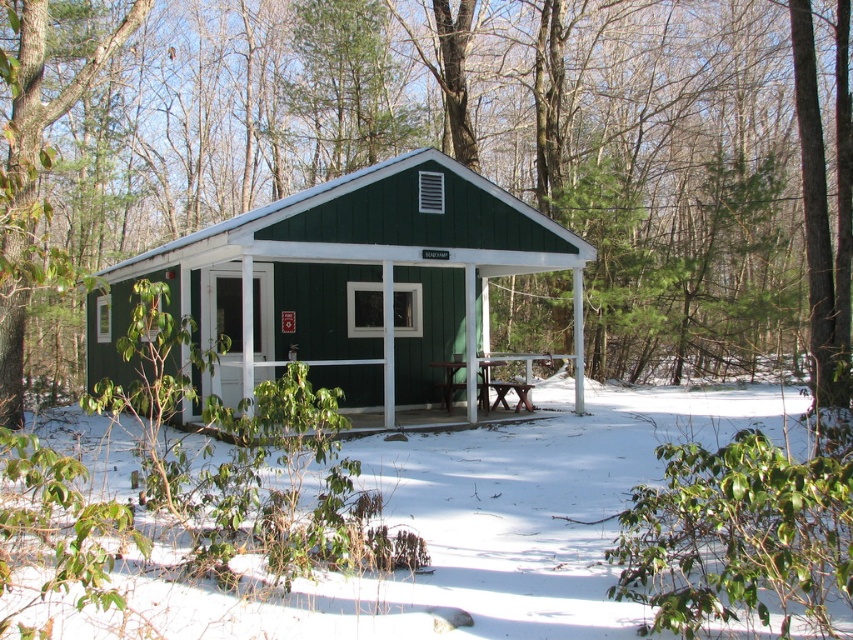
Does point (84, 422) come farther from viewer compared to point (529, 387)?

No.

Can you confirm if white powdery snow at lower center is positioned above brown wooden picnic table at lower center?

Actually, white powdery snow at lower center is below brown wooden picnic table at lower center.

Image resolution: width=853 pixels, height=640 pixels. What are the coordinates of `white powdery snow at lower center` in the screenshot? It's located at (491, 525).

You are a GUI agent. You are given a task and a screenshot of the screen. Output one action in this format:
    pyautogui.click(x=<x>, y=<y>)
    Task: Click on the white powdery snow at lower center
    The image size is (853, 640).
    Given the screenshot: What is the action you would take?
    pyautogui.click(x=491, y=525)

Between white powdery snow at lower center and green matte cabin at center, which one appears on the right side from the viewer's perspective?

Positioned to the right is white powdery snow at lower center.

Measure the distance from white powdery snow at lower center to green matte cabin at center.

white powdery snow at lower center is 2.63 meters from green matte cabin at center.

Where is `white powdery snow at lower center`? This screenshot has height=640, width=853. white powdery snow at lower center is located at coordinates (491, 525).

I want to click on white powdery snow at lower center, so click(x=491, y=525).

Can you confirm if white powdery snow at lower center is shorter than green wood porch at center?

Incorrect, white powdery snow at lower center's height does not fall short of green wood porch at center's.

Which is behind, point (403, 598) or point (442, 413)?

The point (442, 413) is more distant.

Where is `white powdery snow at lower center`? The width and height of the screenshot is (853, 640). white powdery snow at lower center is located at coordinates (491, 525).